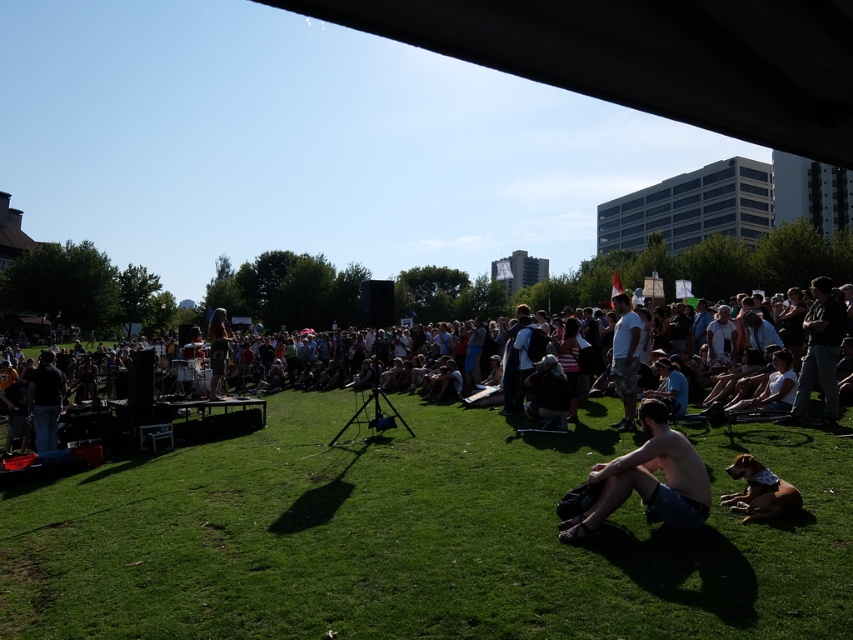
Question: Does dark gray jeans at center have a lesser width compared to white cotton t-shirt at center?

Choices:
 (A) yes
 (B) no

Answer: (B)

Question: In this image, where is dark gray shirt at left located relative to dark gray backpack at center?

Choices:
 (A) right
 (B) left

Answer: (B)

Question: Based on their relative distances, which object is farther from the dark gray shirt at left?

Choices:
 (A) dark gray backpack at center
 (B) white cotton t-shirt at center
 (C) dark gray jeans at center
 (D) shiny blue shorts at lower center

Answer: (C)

Question: Which object is the farthest from the dark gray shirt at left?

Choices:
 (A) white cotton t-shirt at center
 (B) shiny blue shorts at lower center
 (C) dark gray backpack at center
 (D) dark gray jeans at center

Answer: (D)

Question: Which point appears farthest from the camera in this image?

Choices:
 (A) (618, 333)
 (B) (38, 380)
 (C) (519, 316)

Answer: (C)

Question: Observing the image, what is the correct spatial positioning of white cotton t-shirt at center in reference to dark gray shirt at left?

Choices:
 (A) above
 (B) below

Answer: (A)